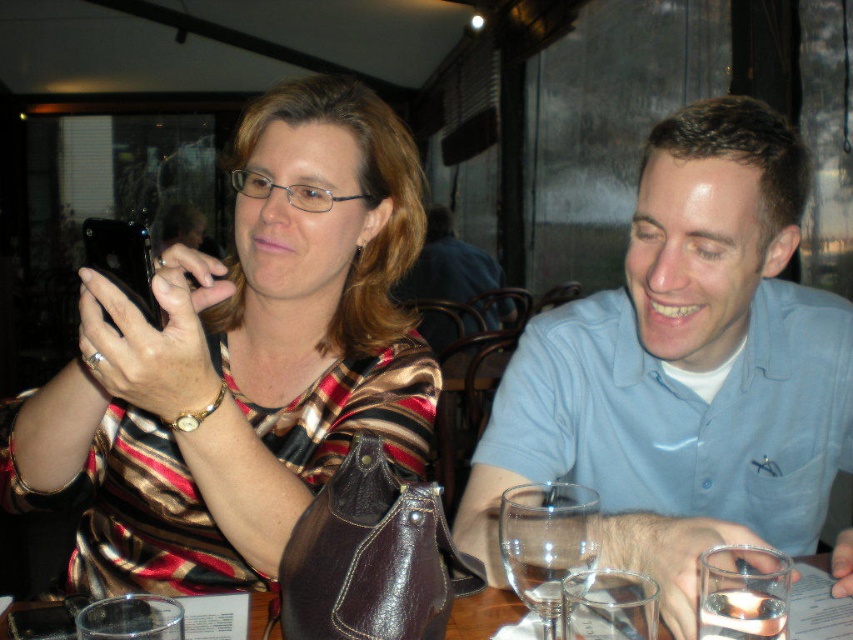
Who is shorter, shiny brown purse at center or blue cotton shirt at center?

Standing shorter between the two is blue cotton shirt at center.

Is point (111, 456) more distant than point (610, 326)?

No, it is not.

Between point (386, 170) and point (720, 150), which one is positioned behind?

The point (386, 170) is behind.

Identify the location of shiny brown purse at center. (242, 360).

Based on the photo, which is above, blue cotton shirt at center or transparent glass at lower center?

Positioned higher is blue cotton shirt at center.

Between blue cotton shirt at center and transparent glass at lower center, which one appears on the right side from the viewer's perspective?

Positioned to the right is blue cotton shirt at center.

Is point (776, 269) in front of point (564, 529)?

No.

Locate an element on the screen. blue cotton shirt at center is located at coordinates (685, 369).

Is point (836, 388) less distant than point (267, 604)?

No, (836, 388) is behind (267, 604).

Which is more to the right, blue cotton shirt at center or transparent glassware at center?

blue cotton shirt at center

Identify the location of blue cotton shirt at center. This screenshot has width=853, height=640. (685, 369).